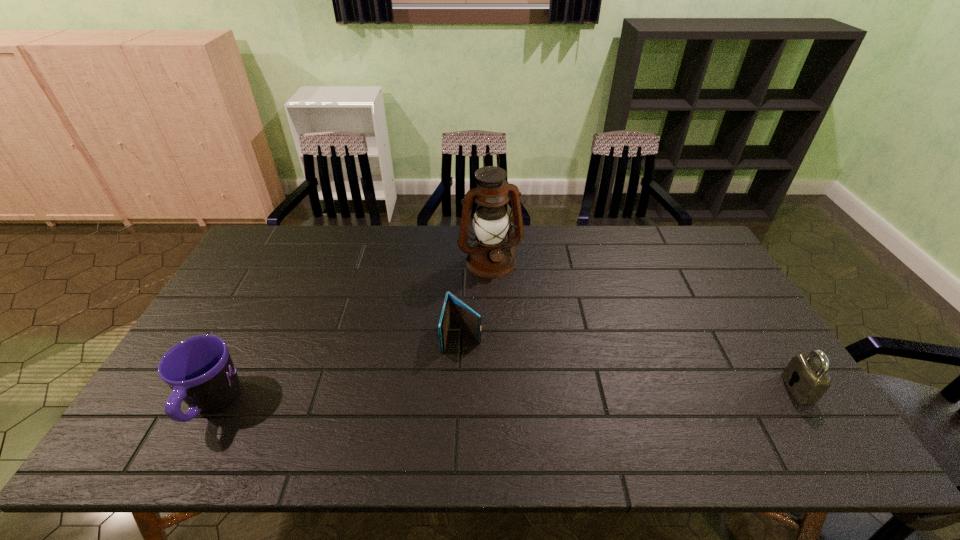
Identify the location of vacant region between the padlock and the mug. (505, 396).

At what (x,y) coordinates should I click in order to perform the action: click on vacant area that lies between the leftmost object and the padlock. Please return your answer as a coordinate pair (x, y). Looking at the image, I should click on (505, 396).

Find the location of a particular element. vacant space in between the mug and the second farthest object is located at coordinates (337, 370).

I want to click on free spot between the mug and the shortest object, so point(337,370).

Locate an element on the screen. free space between the leftmost object and the rightmost object is located at coordinates (505, 396).

Find the location of `empty location between the shortest object and the padlock`. empty location between the shortest object and the padlock is located at coordinates (630, 362).

The width and height of the screenshot is (960, 540). In order to click on empty space between the rightmost object and the third nearest object in this screenshot , I will do `click(630, 362)`.

Locate an element on the screen. vacant space that is in between the wallet and the leftmost object is located at coordinates (337, 370).

Choose which object is the nearest neighbor to the rightmost object. Please provide its 2D coordinates. Your answer should be formatted as a tuple, i.e. [(x, y)], where the tuple contains the x and y coordinates of a point satisfying the conditions above.

[(490, 256)]

Image resolution: width=960 pixels, height=540 pixels. Find the location of `object that stands as the third closest to the rightmost object`. object that stands as the third closest to the rightmost object is located at coordinates (200, 371).